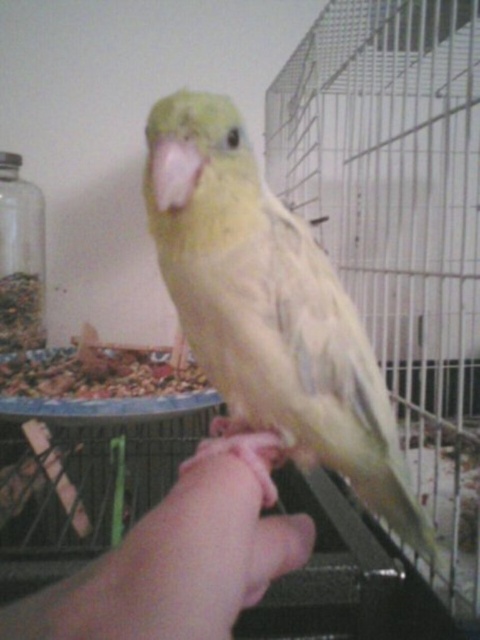
You are a veterinarian examining a parrot and its owner. You notice the yellow matte parrot at center and the pink fabric hand at center. Based on their sizes, which one is taller?

The yellow matte parrot at center is taller than the pink fabric hand at center.

You are standing in front of the birdcage and want to place a small decoration between the two points labeled point (297, 243) and point (236, 460). Which point should the decoration be closer to in order to be positioned between them?

The decoration should be closer to point (236, 460) because point (297, 243) is behind it.

You are a small toy that is 10 cm wide. You want to fit between the yellow matte parrot at center and the pink fabric hand at center. Can you do it?

The yellow matte parrot at center is wider than the pink fabric hand at center. Since the toy is 10 cm wide, it depends on the actual space between them. However, the description only mentions the parrot is wider, not the distance between them. Therefore, we cannot determine if the toy can fit based on the given information.